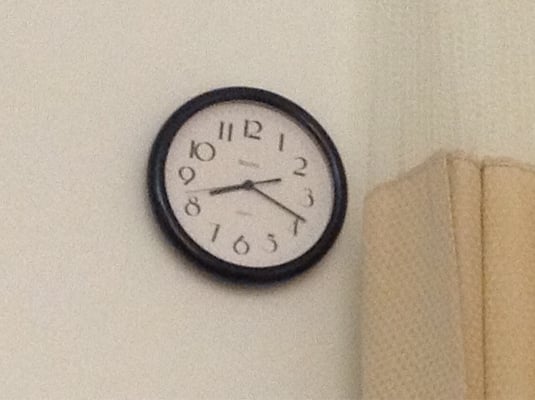
At what (x,y) coordinates should I click in order to perform the action: click on clock. Please return your answer as a coordinate pair (x, y). The height and width of the screenshot is (400, 535). Looking at the image, I should click on (211, 119).